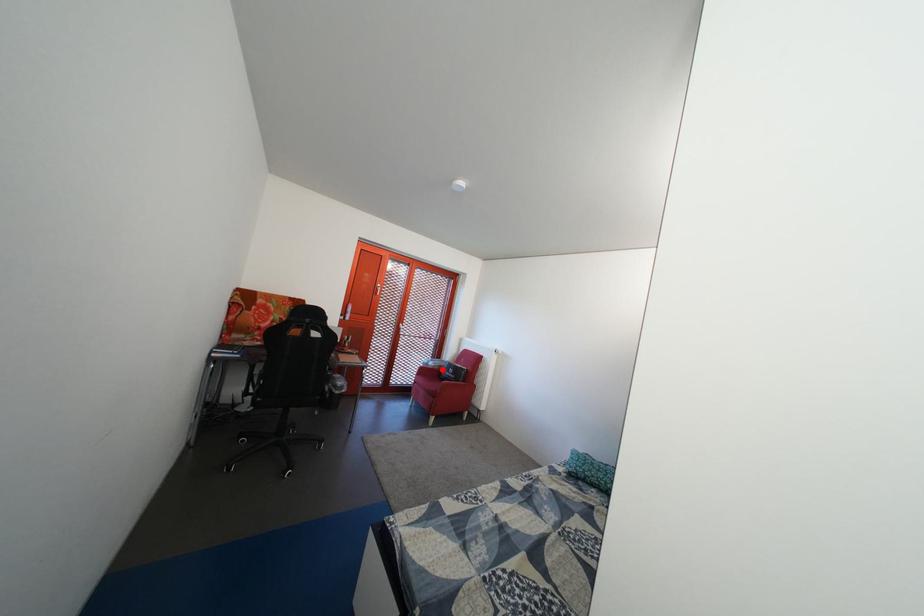
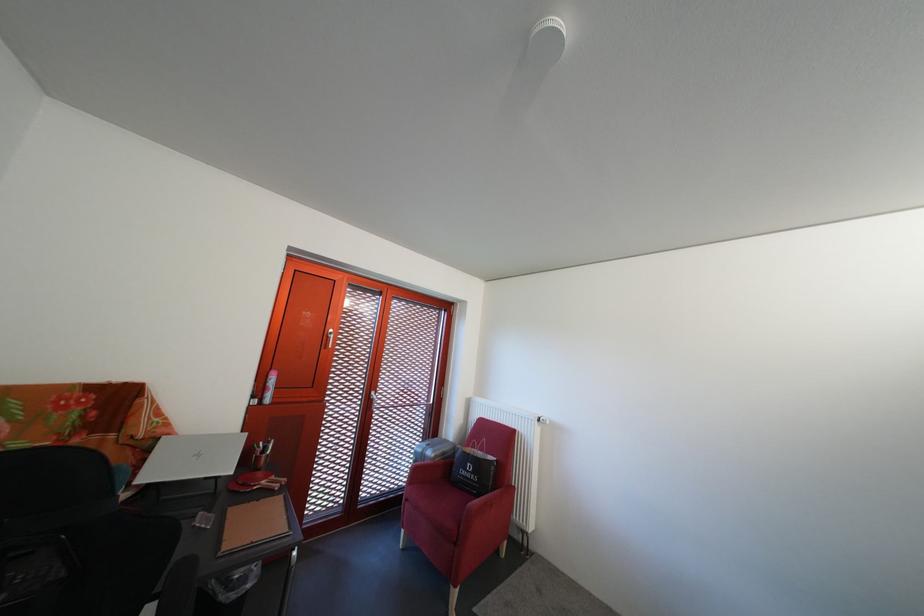
Find the pixel in the second image that matches the highlighted location in the first image.

(441, 459)